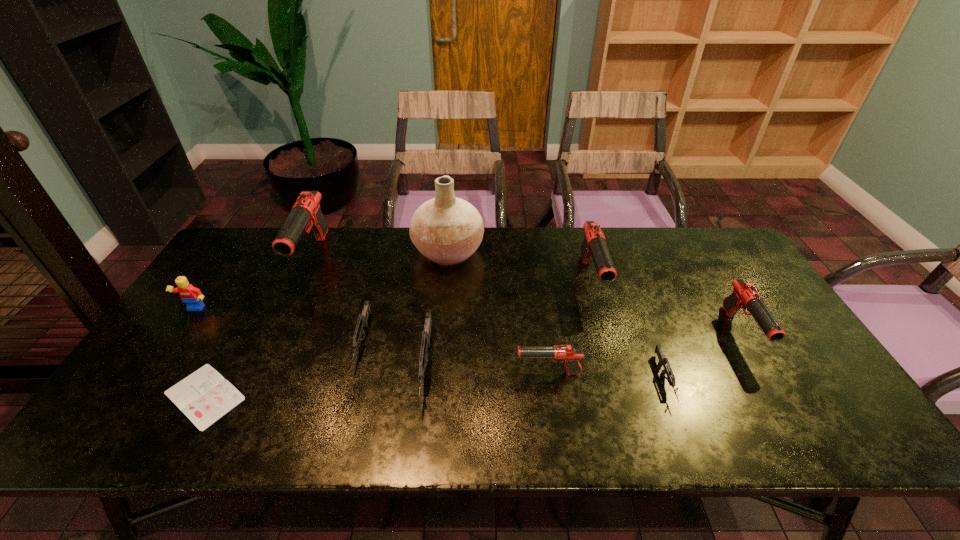
Identify the location of the second black gun from left to right. 568,354.

Identify the location of the nearest black gun. The image size is (960, 540). (568, 354).

The height and width of the screenshot is (540, 960). I want to click on the fourth shortest object, so click(x=426, y=334).

You are a GUI agent. You are given a task and a screenshot of the screen. Output one action in this format:
    pyautogui.click(x=<x>, y=<y>)
    Task: Click on the second grey gun from right to left
    Image resolution: width=960 pixels, height=540 pixels.
    Given the screenshot: What is the action you would take?
    pyautogui.click(x=426, y=334)

Locate an element on the screen. the sixth gun from right to left is located at coordinates (362, 322).

Find the location of a particular element. the second biggest grey gun is located at coordinates (362, 322).

You are a GUI agent. You are given a task and a screenshot of the screen. Output one action in this format:
    pyautogui.click(x=<x>, y=<y>)
    Task: Click on the ninth object from left to right
    
    Given the screenshot: What is the action you would take?
    pyautogui.click(x=667, y=370)

What are the coordinates of `the smallest grey gun` in the screenshot? It's located at (667, 370).

Identify the location of diary. The width and height of the screenshot is (960, 540). (204, 396).

Locate an element on the screen. Image resolution: width=960 pixels, height=540 pixels. vacant space situated to pour from the handle of the tallest object is located at coordinates (581, 252).